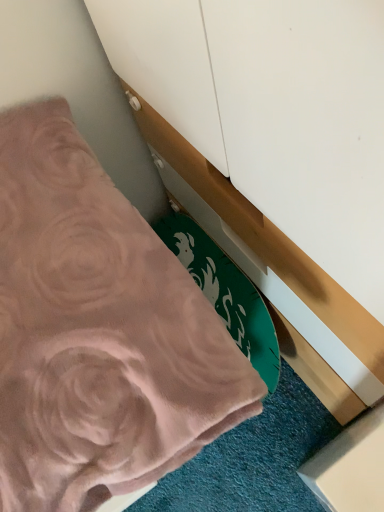
Image resolution: width=384 pixels, height=512 pixels. Describe the element at coordinates (97, 331) in the screenshot. I see `pink plush blanket at lower left` at that location.

I want to click on pink plush blanket at lower left, so [x=97, y=331].

Where is `pink plush blanket at lower left`? This screenshot has height=512, width=384. pink plush blanket at lower left is located at coordinates (97, 331).